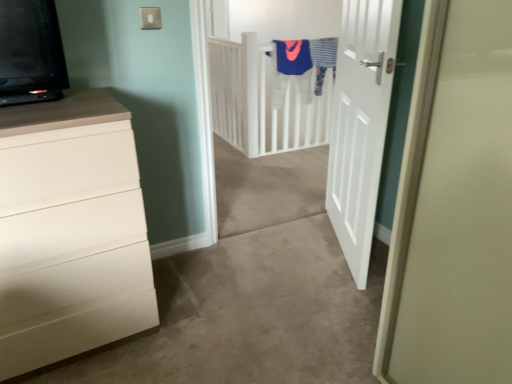
Question: Should I look upward or downward to see white matte chest of drawers at left?

Choices:
 (A) up
 (B) down

Answer: (B)

Question: Does white matte door at center contain white plastic electric outlet at upper center?

Choices:
 (A) yes
 (B) no

Answer: (B)

Question: Is white matte door at center not within white plastic electric outlet at upper center?

Choices:
 (A) no
 (B) yes

Answer: (B)

Question: Does white matte door at center turn towards white plastic electric outlet at upper center?

Choices:
 (A) yes
 (B) no

Answer: (A)

Question: From a real-world perspective, is white matte door at center on white plastic electric outlet at upper center?

Choices:
 (A) yes
 (B) no

Answer: (B)

Question: Is white matte door at center wider than white plastic electric outlet at upper center?

Choices:
 (A) yes
 (B) no

Answer: (A)

Question: Considering the relative positions of white matte door at center and white plastic electric outlet at upper center in the image provided, is white matte door at center to the right of white plastic electric outlet at upper center from the viewer's perspective?

Choices:
 (A) no
 (B) yes

Answer: (B)

Question: Does white matte door at center appear on the left side of white matte chest of drawers at left?

Choices:
 (A) no
 (B) yes

Answer: (A)

Question: Is white matte door at center in front of white matte chest of drawers at left?

Choices:
 (A) no
 (B) yes

Answer: (A)

Question: From a real-world perspective, is white matte door at center on top of white matte chest of drawers at left?

Choices:
 (A) no
 (B) yes

Answer: (B)

Question: Is white matte door at center oriented away from white matte chest of drawers at left?

Choices:
 (A) yes
 (B) no

Answer: (B)

Question: Does white matte door at center have a larger size compared to white matte chest of drawers at left?

Choices:
 (A) no
 (B) yes

Answer: (A)

Question: Does white matte door at center have a lesser height compared to white matte chest of drawers at left?

Choices:
 (A) yes
 (B) no

Answer: (B)

Question: Does white matte chest of drawers at left have a lesser height compared to white matte door at center?

Choices:
 (A) yes
 (B) no

Answer: (A)